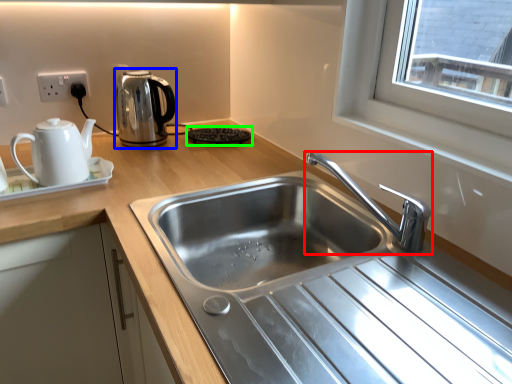
Question: Estimate the real-world distances between objects in this image. Which object is farther from tap (highlighted by a red box), kettle (highlighted by a blue box) or appliance (highlighted by a green box)?

Choices:
 (A) kettle
 (B) appliance

Answer: (A)